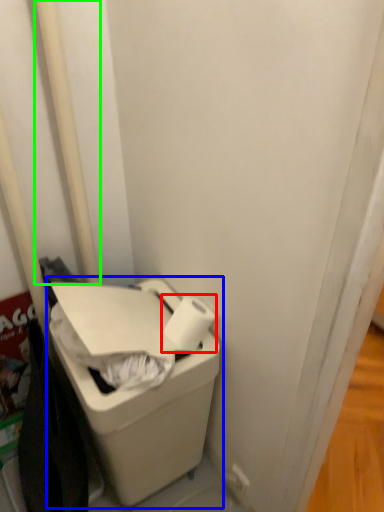
Question: Which is nearer to the toilet paper (highlighted by a red box)? waste container (highlighted by a blue box) or pole (highlighted by a green box).

Choices:
 (A) waste container
 (B) pole

Answer: (A)